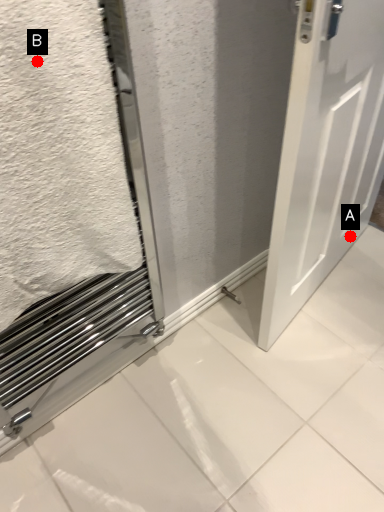
Question: Two points are circled on the image, labeled by A and B beside each circle. Which point appears farthest from the camera in this image?

Choices:
 (A) A is further
 (B) B is further

Answer: (A)